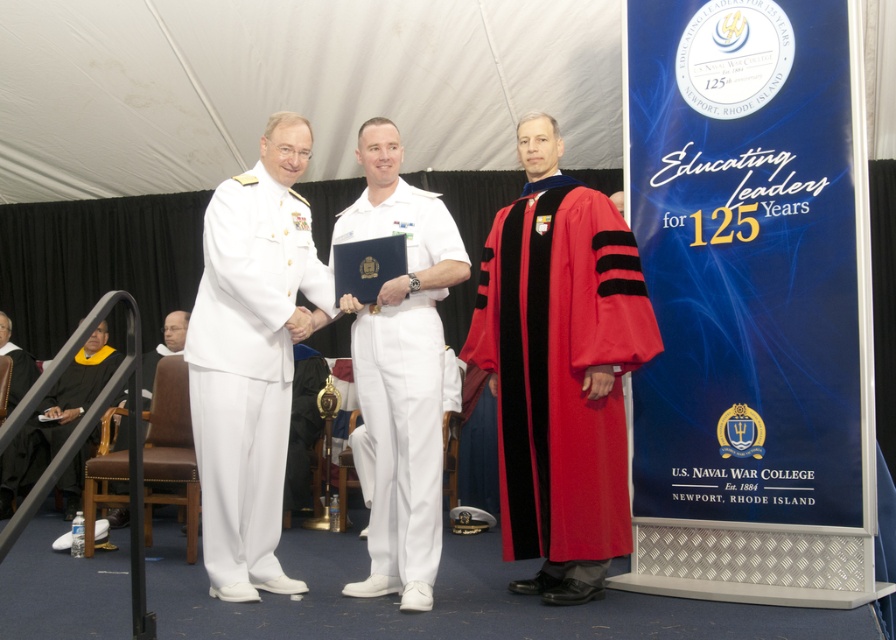
Can you confirm if red velvet graduation gown at center is taller than white cotton dress uniform at left?

No, red velvet graduation gown at center is not taller than white cotton dress uniform at left.

Can you confirm if red velvet graduation gown at center is bigger than white cotton dress uniform at left?

Yes.

In order to click on red velvet graduation gown at center in this screenshot , I will do `click(560, 368)`.

You are a GUI agent. You are given a task and a screenshot of the screen. Output one action in this format:
    pyautogui.click(x=<x>, y=<y>)
    Task: Click on the red velvet graduation gown at center
    This screenshot has height=640, width=896.
    Given the screenshot: What is the action you would take?
    pyautogui.click(x=560, y=368)

Does white cotton dress uniform at left appear on the left side of black matte graduation gown at lower left?

In fact, white cotton dress uniform at left is to the right of black matte graduation gown at lower left.

Measure the distance between point [231,182] and camera.

They are 3.49 meters apart.

Identify the location of white cotton dress uniform at left. (247, 372).

Is graduation gown at lower left to the right of black matte graduation gown at lower left from the viewer's perspective?

Correct, you'll find graduation gown at lower left to the right of black matte graduation gown at lower left.

Who is positioned more to the right, graduation gown at lower left or black matte graduation gown at lower left?

Positioned to the right is graduation gown at lower left.

Where is `graduation gown at lower left`? graduation gown at lower left is located at coordinates (76, 392).